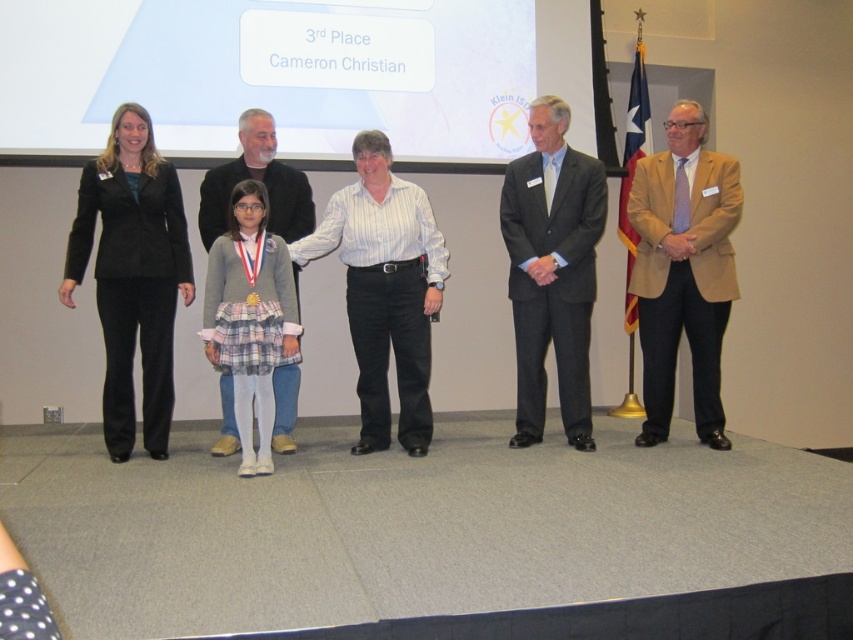
You are organizing a photoshoot and need to arrange two men wearing suits from the image. The black suit at left and the dark gray suit at center are both in your selection. If you want to place them side by side for a group photo, which one should be placed on the left to maintain visual balance?

The black suit at left should be placed on the left side since it is larger in size compared to the dark gray suit at center, which will help maintain visual balance by having the larger figure on the side opposite to the smaller one.

You are a photographer at the award ceremony. You need to take a photo of the black suit at left and the black wool sweater at center. Which one is on the left side of the other?

The black suit at left is positioned on the left side of black wool sweater at center.

You are organizing a photo shoot and need to position a spotlight on the person wearing the black suit at left. According to the coordinates provided, where should you aim the spotlight? Please specify the coordinates from the scene description.

The black suit at left is located at point (132, 275), so you should aim the spotlight at those coordinates to focus on the person wearing the black suit at left.